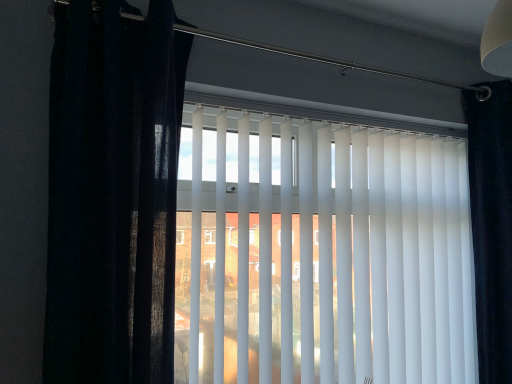
Image resolution: width=512 pixels, height=384 pixels. I want to click on white matte vertical blinds at center, so click(324, 254).

Locate an element on the screen. Image resolution: width=512 pixels, height=384 pixels. curtain that appears on the right of white matte vertical blinds at center is located at coordinates (490, 224).

From their relative heights in the image, would you say black velvet curtain at right, the 1th curtain from the back, is taller or shorter than white matte vertical blinds at center?

Clearly, black velvet curtain at right, the 1th curtain from the back, is taller compared to white matte vertical blinds at center.

Is black velvet curtain at right, the second curtain in the front-to-back sequence, at the right side of white matte vertical blinds at center?

Yes, black velvet curtain at right, the second curtain in the front-to-back sequence, is to the right of white matte vertical blinds at center.

Considering the relative positions of white matte vertical blinds at center and matte black curtain at left, marked as the first curtain in a left-to-right arrangement, in the image provided, is white matte vertical blinds at center to the right of matte black curtain at left, marked as the first curtain in a left-to-right arrangement, from the viewer's perspective?

Yes, white matte vertical blinds at center is to the right of matte black curtain at left, marked as the first curtain in a left-to-right arrangement.

Looking at this image, from the image's perspective, does white matte vertical blinds at center appear lower than matte black curtain at left, marked as the first curtain in a left-to-right arrangement?

Correct, white matte vertical blinds at center appears lower than matte black curtain at left, marked as the first curtain in a left-to-right arrangement, in the image.

Based on the photo, does white matte vertical blinds at center have a lesser height compared to matte black curtain at left, which is the 1th curtain in front-to-back order?

Incorrect, the height of white matte vertical blinds at center does not fall short of that of matte black curtain at left, which is the 1th curtain in front-to-back order.

I want to click on window blind in front of the black velvet curtain at right, the second curtain in the front-to-back sequence, so click(x=324, y=254).

What's the angular difference between white matte vertical blinds at center and black velvet curtain at right, the second curtain in the front-to-back sequence,'s facing directions?

0.876 degrees separate the facing orientations of white matte vertical blinds at center and black velvet curtain at right, the second curtain in the front-to-back sequence.

Is white matte vertical blinds at center to the left or to the right of black velvet curtain at right, the second curtain in the front-to-back sequence, in the image?

From the image, it's evident that white matte vertical blinds at center is to the left of black velvet curtain at right, the second curtain in the front-to-back sequence.

Between point (259, 191) and point (490, 161), which one is positioned behind?

The point (490, 161) is more distant.

Is point (500, 290) closer or farther from the camera than point (165, 360)?

Point (500, 290).

Does black velvet curtain at right, acting as the second curtain starting from the left, touch matte black curtain at left, marked as the first curtain in a left-to-right arrangement?

No.

Can you confirm if black velvet curtain at right, the 1th curtain from the back, is taller than matte black curtain at left, marked as the first curtain in a left-to-right arrangement?

Indeed, black velvet curtain at right, the 1th curtain from the back, has a greater height compared to matte black curtain at left, marked as the first curtain in a left-to-right arrangement.

Considering the relative sizes of black velvet curtain at right, the second curtain in the front-to-back sequence, and matte black curtain at left, acting as the second curtain starting from the back, in the image provided, is black velvet curtain at right, the second curtain in the front-to-back sequence, smaller than matte black curtain at left, acting as the second curtain starting from the back,?

Correct, black velvet curtain at right, the second curtain in the front-to-back sequence, occupies less space than matte black curtain at left, acting as the second curtain starting from the back.

Looking at this image, is matte black curtain at left, marked as the first curtain in a left-to-right arrangement, bigger or smaller than white matte vertical blinds at center?

matte black curtain at left, marked as the first curtain in a left-to-right arrangement, is smaller than white matte vertical blinds at center.

From a real-world perspective, who is located higher, matte black curtain at left, acting as the second curtain starting from the back, or white matte vertical blinds at center?

In real-world perspective, matte black curtain at left, acting as the second curtain starting from the back, is above.

In the image, is matte black curtain at left, marked as the first curtain in a left-to-right arrangement, positioned in front of or behind white matte vertical blinds at center?

matte black curtain at left, marked as the first curtain in a left-to-right arrangement, is positioned closer to the viewer than white matte vertical blinds at center.

Between matte black curtain at left, acting as the second curtain starting from the back, and white matte vertical blinds at center, which one has larger width?

matte black curtain at left, acting as the second curtain starting from the back.

Which of these two, matte black curtain at left, which is the 1th curtain in front-to-back order, or black velvet curtain at right, the 1th curtain from the back, stands shorter?

With less height is matte black curtain at left, which is the 1th curtain in front-to-back order.

Is matte black curtain at left, acting as the second curtain starting from the back, looking in the opposite direction of black velvet curtain at right, positioned as the first curtain in right-to-left order?

That's not correct — matte black curtain at left, acting as the second curtain starting from the back, is not looking away from black velvet curtain at right, positioned as the first curtain in right-to-left order.

Between matte black curtain at left, positioned as the second curtain in right-to-left order, and black velvet curtain at right, acting as the second curtain starting from the left, which one appears on the right side from the viewer's perspective?

Positioned to the right is black velvet curtain at right, acting as the second curtain starting from the left.

Image resolution: width=512 pixels, height=384 pixels. Find the location of `window blind on the left side of black velvet curtain at right, the 1th curtain from the back`. window blind on the left side of black velvet curtain at right, the 1th curtain from the back is located at coordinates (324, 254).

Identify the location of the 2nd curtain above the white matte vertical blinds at center (from a real-world perspective). (113, 192).

Based on the photo, estimate the real-world distances between objects in this image. Which object is closer to matte black curtain at left, positioned as the second curtain in right-to-left order, black velvet curtain at right, acting as the second curtain starting from the left, or white matte vertical blinds at center?

The object closer to matte black curtain at left, positioned as the second curtain in right-to-left order, is white matte vertical blinds at center.

Estimate the real-world distances between objects in this image. Which object is closer to black velvet curtain at right, the second curtain in the front-to-back sequence, white matte vertical blinds at center or matte black curtain at left, which is the 1th curtain in front-to-back order?

Based on the image, white matte vertical blinds at center appears to be nearer to black velvet curtain at right, the second curtain in the front-to-back sequence.

Considering their positions, is matte black curtain at left, positioned as the second curtain in right-to-left order, positioned further to white matte vertical blinds at center than black velvet curtain at right, positioned as the first curtain in right-to-left order?

black velvet curtain at right, positioned as the first curtain in right-to-left order, is further to white matte vertical blinds at center.

From the image, which object appears to be nearer to white matte vertical blinds at center, black velvet curtain at right, acting as the second curtain starting from the left, or matte black curtain at left, marked as the first curtain in a left-to-right arrangement?

Based on the image, matte black curtain at left, marked as the first curtain in a left-to-right arrangement, appears to be nearer to white matte vertical blinds at center.

When comparing their distances from matte black curtain at left, marked as the first curtain in a left-to-right arrangement, does white matte vertical blinds at center or black velvet curtain at right, the 1th curtain from the back, seem further?

Based on the image, black velvet curtain at right, the 1th curtain from the back, appears to be further to matte black curtain at left, marked as the first curtain in a left-to-right arrangement.

Estimate the real-world distances between objects in this image. Which object is closer to black velvet curtain at right, positioned as the first curtain in right-to-left order, matte black curtain at left, marked as the first curtain in a left-to-right arrangement, or white matte vertical blinds at center?

white matte vertical blinds at center lies closer to black velvet curtain at right, positioned as the first curtain in right-to-left order, than the other object.

Where is `window blind situated between matte black curtain at left, positioned as the second curtain in right-to-left order, and black velvet curtain at right, the 1th curtain from the back, from left to right`? window blind situated between matte black curtain at left, positioned as the second curtain in right-to-left order, and black velvet curtain at right, the 1th curtain from the back, from left to right is located at coordinates (324, 254).